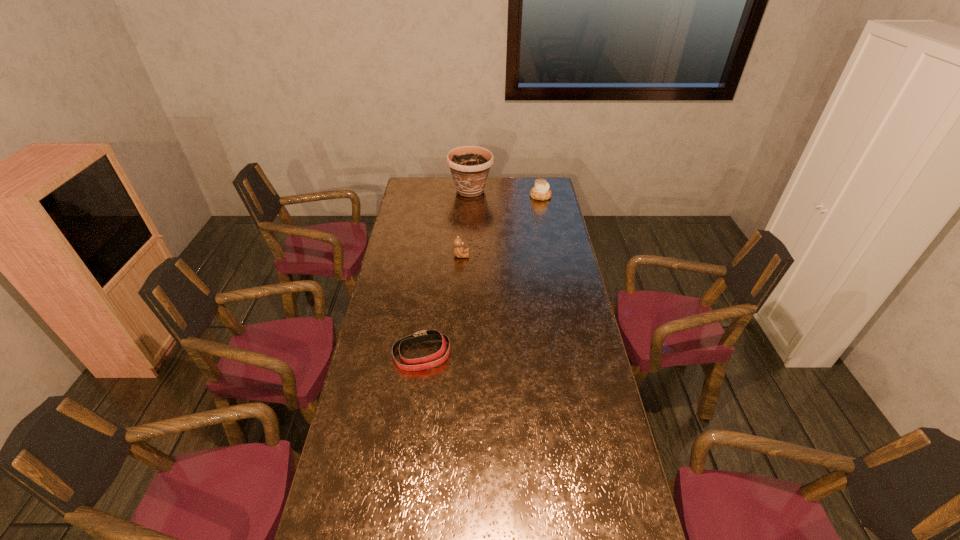
The height and width of the screenshot is (540, 960). In order to click on pastry that is at the far edge in this screenshot , I will do `click(541, 191)`.

I want to click on object present at the left edge, so click(426, 362).

Find the location of a particular element. This screenshot has width=960, height=540. object that is at the right edge is located at coordinates 541,191.

Where is `object that is at the far right corner`? object that is at the far right corner is located at coordinates (541, 191).

This screenshot has height=540, width=960. Find the location of `vacant area at the far edge of the desktop`. vacant area at the far edge of the desktop is located at coordinates (x=486, y=195).

What are the coordinates of `vacant space at the left edge of the desktop` in the screenshot? It's located at (409, 240).

Locate an element on the screen. The width and height of the screenshot is (960, 540). vacant space at the right edge of the desktop is located at coordinates (566, 390).

Locate an element on the screen. Image resolution: width=960 pixels, height=540 pixels. free point between the pastry and the tallest object is located at coordinates (506, 193).

Locate an element on the screen. This screenshot has width=960, height=540. unoccupied position between the pastry and the teddy bear is located at coordinates (501, 226).

You are a GUI agent. You are given a task and a screenshot of the screen. Output one action in this format:
    pyautogui.click(x=<x>, y=<y>)
    Task: Click on the vacant area that lies between the flowerpot and the dog collar
    This screenshot has width=960, height=540.
    Given the screenshot: What is the action you would take?
    pyautogui.click(x=446, y=273)